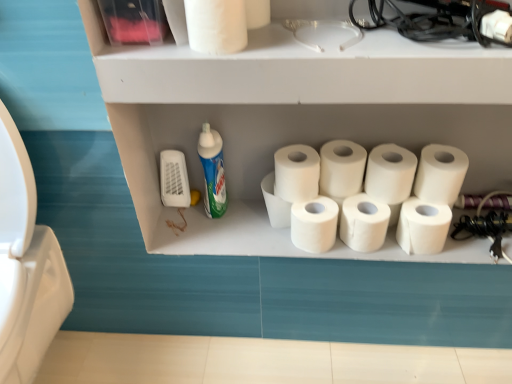
Find the location of a particular element. The width and height of the screenshot is (512, 384). vacant area that is in front of white matte toilet paper at center, positioned as the 3th toilet paper in left-to-right order is located at coordinates (270, 239).